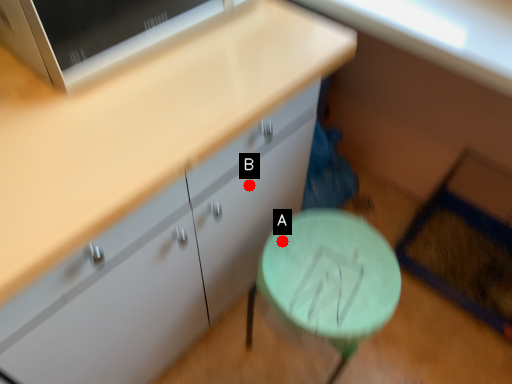
Question: Two points are circled on the image, labeled by A and B beside each circle. Which point appears farthest from the camera in this image?

Choices:
 (A) A is further
 (B) B is further

Answer: (A)